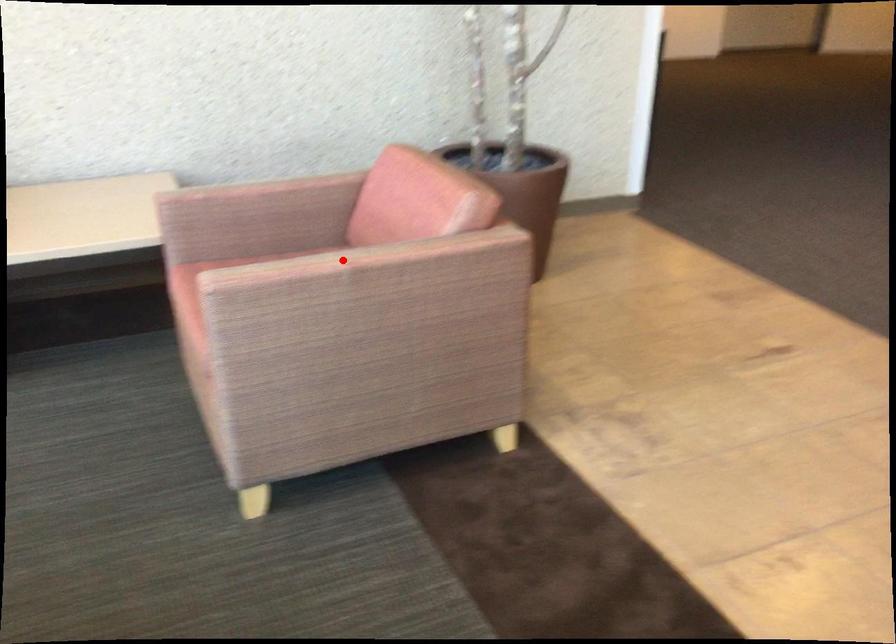
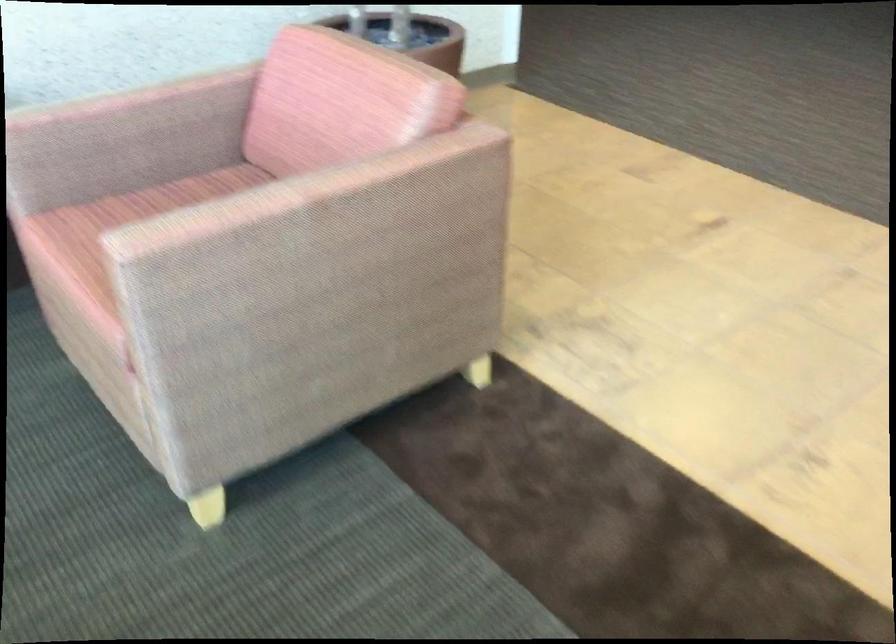
Locate, in the second image, the point that corresponds to the highlighted location in the first image.

(298, 192)